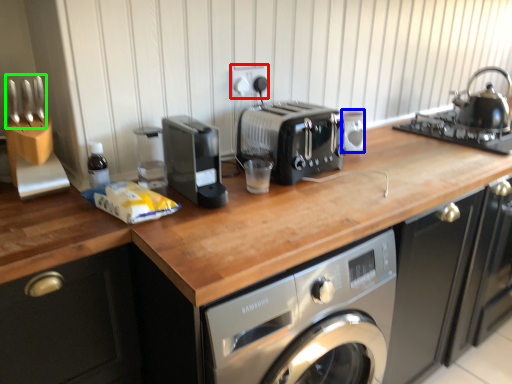
Question: Which object is positioned farthest from electric outlet (highlighted by a red box)? Select from appliance (highlighted by a blue box) and cutlery (highlighted by a green box).

Choices:
 (A) appliance
 (B) cutlery

Answer: (B)